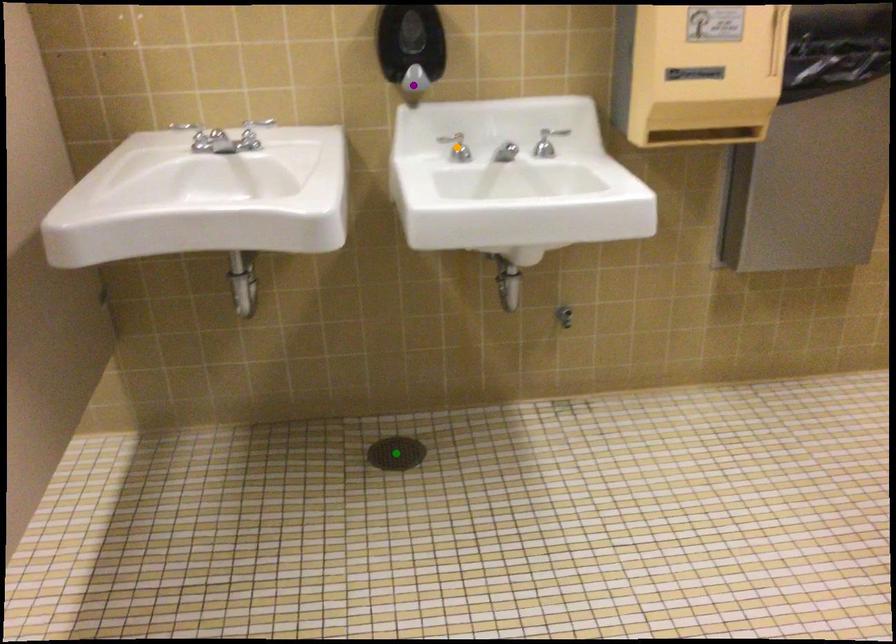
Order these from nearest to farthest:
A) purple point
B) orange point
C) green point

purple point, orange point, green point